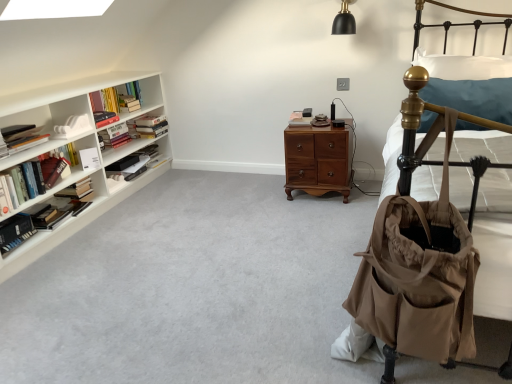
Where is `free space to the left of brown wood nightstand at center`? Image resolution: width=512 pixels, height=384 pixels. free space to the left of brown wood nightstand at center is located at coordinates (264, 195).